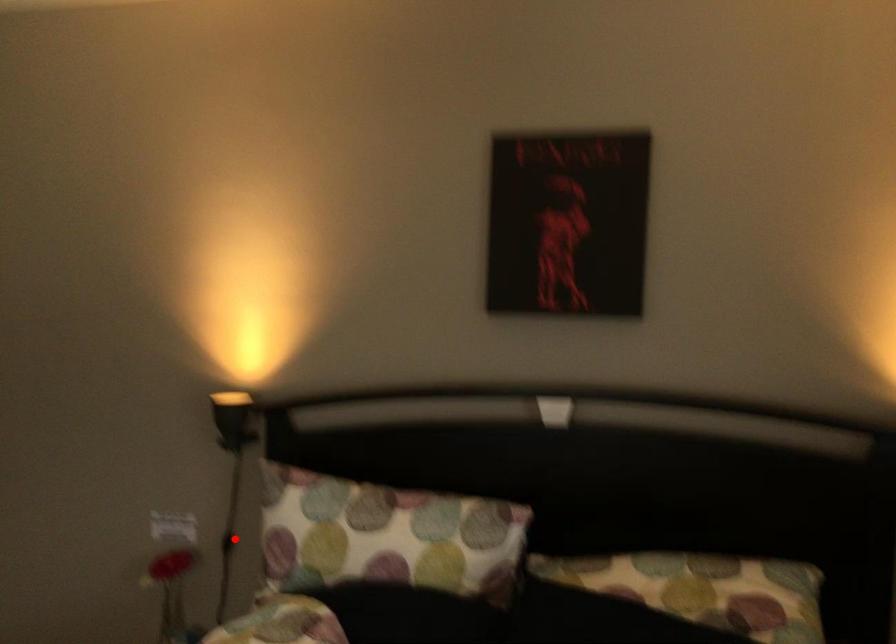
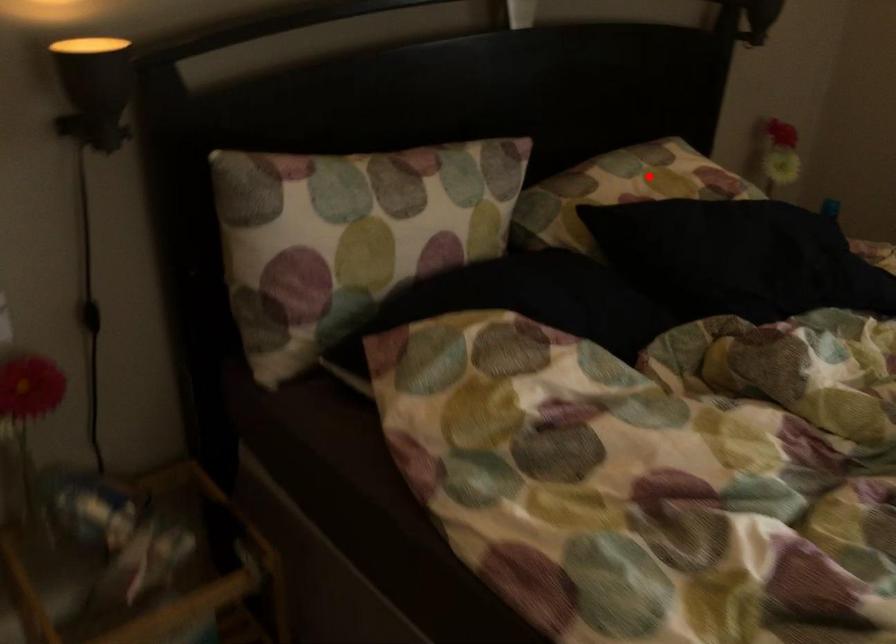
I am providing you with two images of the same scene from different viewpoints. A red point is marked on the first image and another point is marked on the second image. Does the point marked in image1 correspond to the same location as the one in image2?

No